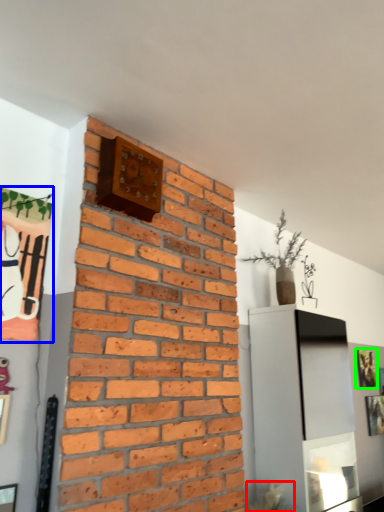
Question: Which object is the farthest from plant (highlighted by a red box)? Choose among these: picture frame (highlighted by a blue box) or picture frame (highlighted by a green box).

Choices:
 (A) picture frame
 (B) picture frame

Answer: (A)